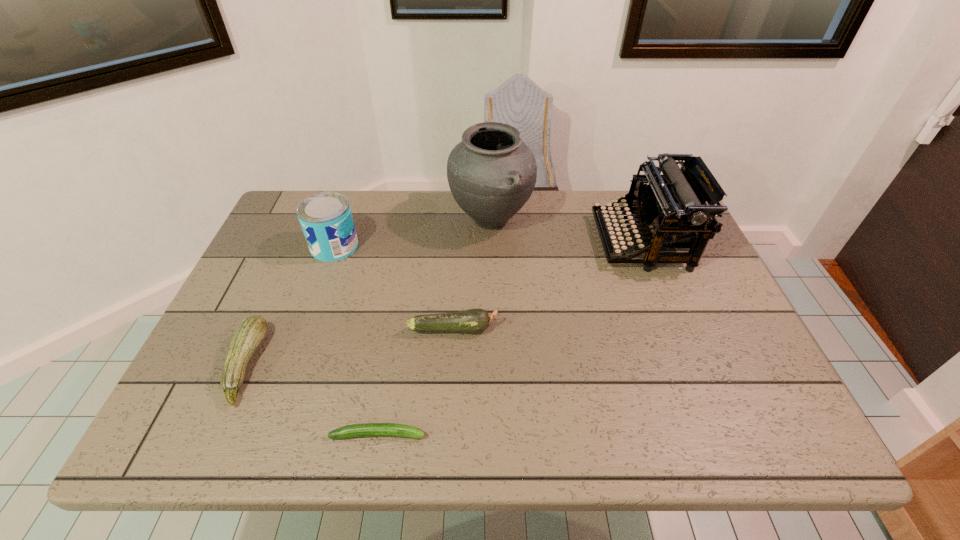
This screenshot has height=540, width=960. What are the coordinates of `vacant space that is in between the second tallest object and the leftmost object` in the screenshot? It's located at (444, 303).

Where is `vacant area between the third tallest object and the rightmost object`? This screenshot has width=960, height=540. vacant area between the third tallest object and the rightmost object is located at coordinates (488, 244).

Find the location of a particular element. The height and width of the screenshot is (540, 960). free space that is in between the leftmost zucchini and the fifth shortest object is located at coordinates (444, 303).

You are a GUI agent. You are given a task and a screenshot of the screen. Output one action in this format:
    pyautogui.click(x=<x>, y=<y>)
    Task: Click on the vacant space in between the second tallest object and the tallest object
    This screenshot has height=540, width=960.
    Given the screenshot: What is the action you would take?
    pyautogui.click(x=566, y=231)

At what (x,y) coordinates should I click in order to perform the action: click on free spot between the tallest object and the rightmost object. Please return your answer as a coordinate pair (x, y). The width and height of the screenshot is (960, 540). Looking at the image, I should click on (566, 231).

This screenshot has width=960, height=540. Find the location of `the closest object relative to the fifth object from right to left`. the closest object relative to the fifth object from right to left is located at coordinates (250, 333).

You are a GUI agent. You are given a task and a screenshot of the screen. Output one action in this format:
    pyautogui.click(x=<x>, y=<y>)
    Task: Click on the object that ranks as the closest to the leftmost zucchini
    The width and height of the screenshot is (960, 540).
    Given the screenshot: What is the action you would take?
    pyautogui.click(x=366, y=429)

Identify which zucchini is the third nearest to the tallest object. Please provide its 2D coordinates. Your answer should be formatted as a tuple, i.e. [(x, y)], where the tuple contains the x and y coordinates of a point satisfying the conditions above.

[(366, 429)]

Find the location of a particular element. the third closest zucchini relative to the typewriter is located at coordinates (250, 333).

Locate an element on the screen. Image resolution: width=960 pixels, height=540 pixels. free space that satisfies the following two spatial constraints: 1. on the front side of the can; 2. at the stem end of the leftmost object is located at coordinates (293, 364).